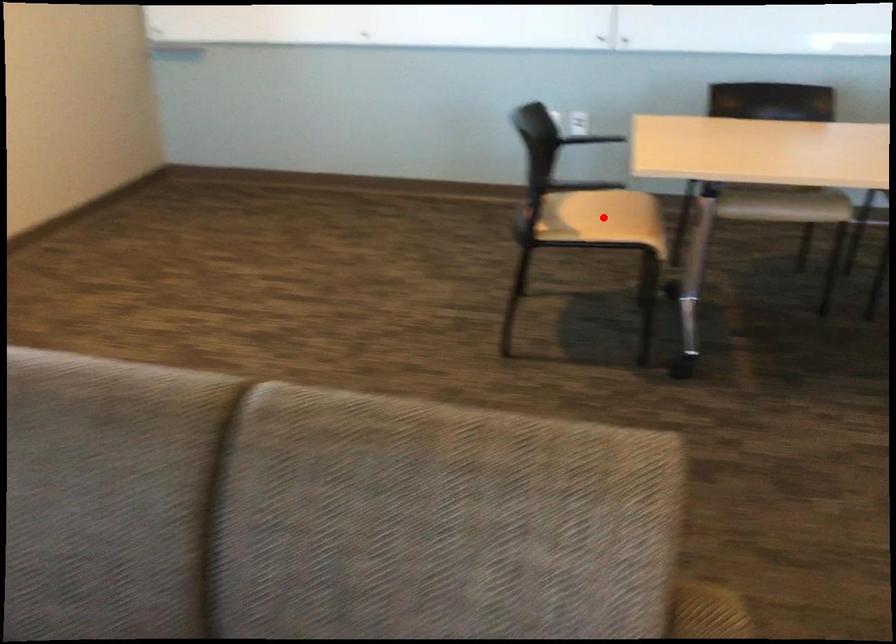
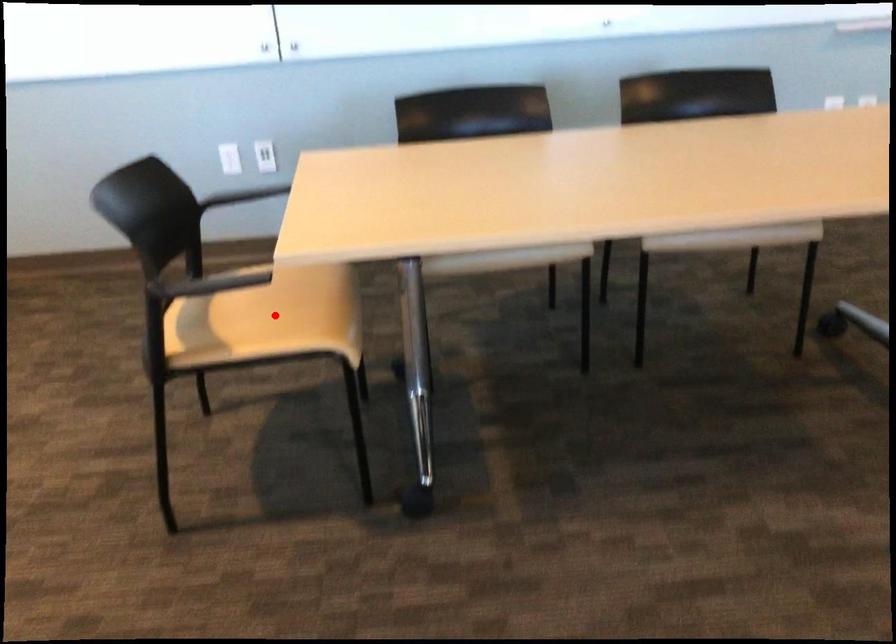
I am providing you with two images of the same scene from different viewpoints. A red point is marked on the first image and another point is marked on the second image. Are the points marked in image1 and image2 representing the same 3D position?

Yes